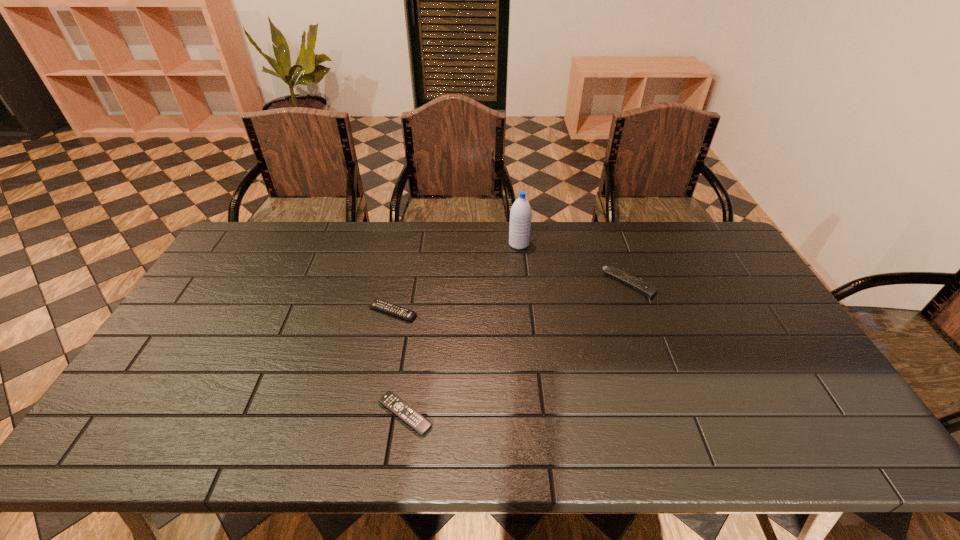
Locate an element on the screen. water bottle is located at coordinates (521, 213).

Identify the location of the tallest object. (521, 213).

Locate an element on the screen. The image size is (960, 540). the rightmost remote control is located at coordinates (649, 291).

Identify the location of the second tallest object. This screenshot has height=540, width=960. coord(649,291).

I want to click on the second farthest remote control, so click(395, 310).

Identify the location of the nearest remote control. The height and width of the screenshot is (540, 960). (393, 403).

Image resolution: width=960 pixels, height=540 pixels. I want to click on vacant space located on the left of the water bottle, so click(x=483, y=244).

Find the location of a particular element. This screenshot has width=960, height=540. vacant point located on the front of the farthest remote control is located at coordinates (678, 414).

In order to click on free space located on the left of the second nearest object in this screenshot , I will do click(x=311, y=312).

Where is `free spot located on the left of the nearest object`? The image size is (960, 540). free spot located on the left of the nearest object is located at coordinates (260, 414).